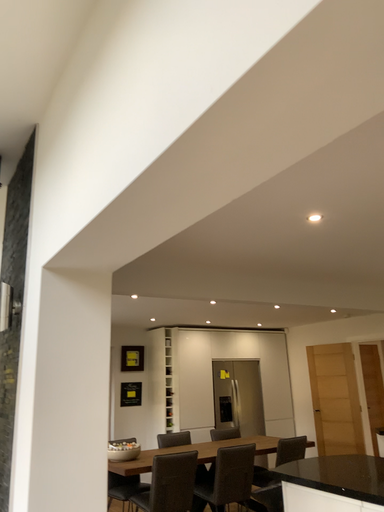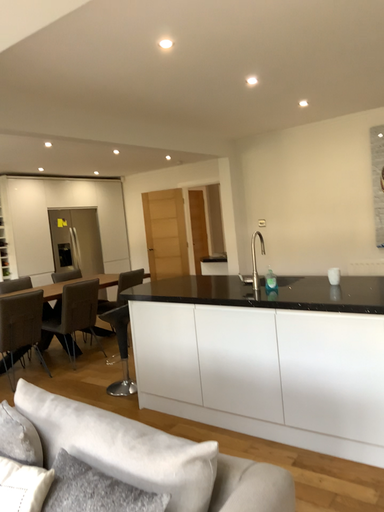
Question: Which way did the camera rotate in the video?

Choices:
 (A) rotated upward
 (B) rotated downward

Answer: (B)